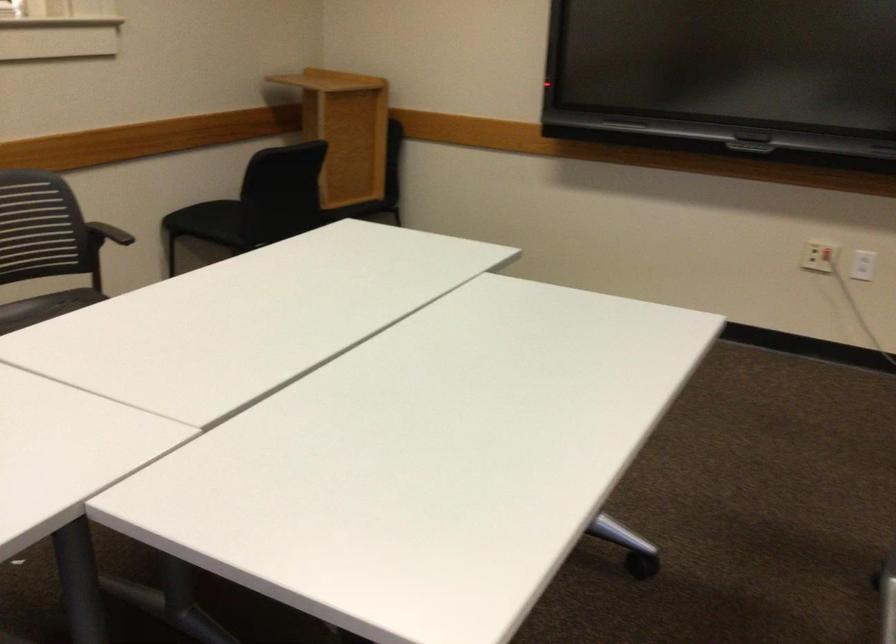
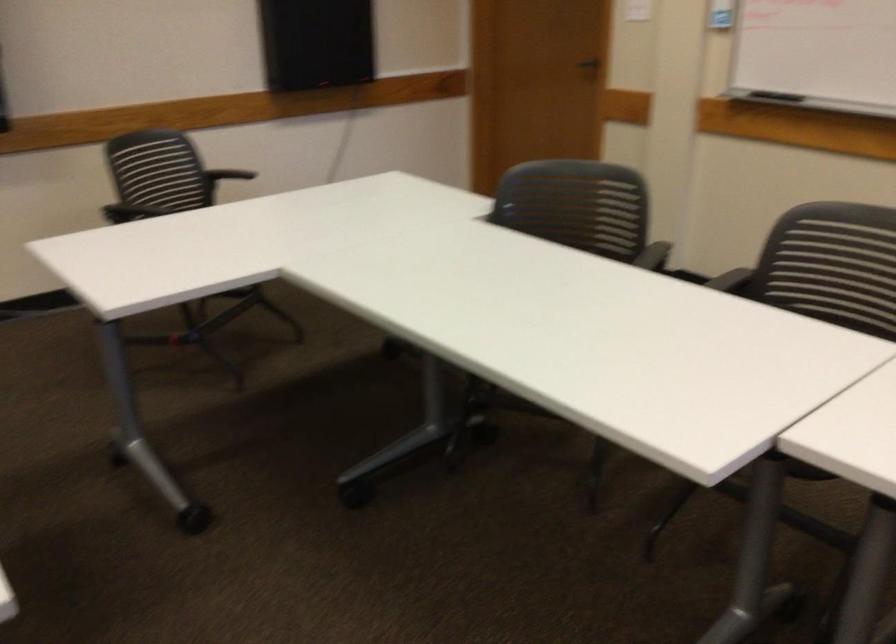
Question: The first image is from the beginning of the video and the second image is from the end. How did the camera likely rotate when shooting the video?

Choices:
 (A) Left
 (B) Right
 (C) Up
 (D) Down

Answer: (B)